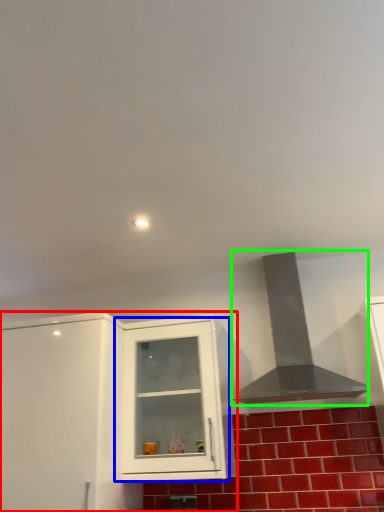
Question: Estimate the real-world distances between objects in this image. Which object is closer to cabinetry (highlighted by a red box), cabinetry (highlighted by a blue box) or vent (highlighted by a green box)?

Choices:
 (A) cabinetry
 (B) vent

Answer: (A)